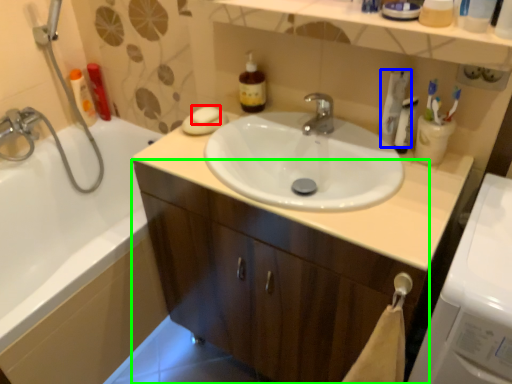
Question: Which is nearer to the soap (highlighted by a red box)? toothpaste (highlighted by a blue box) or bathroom cabinet (highlighted by a green box).

Choices:
 (A) toothpaste
 (B) bathroom cabinet

Answer: (A)